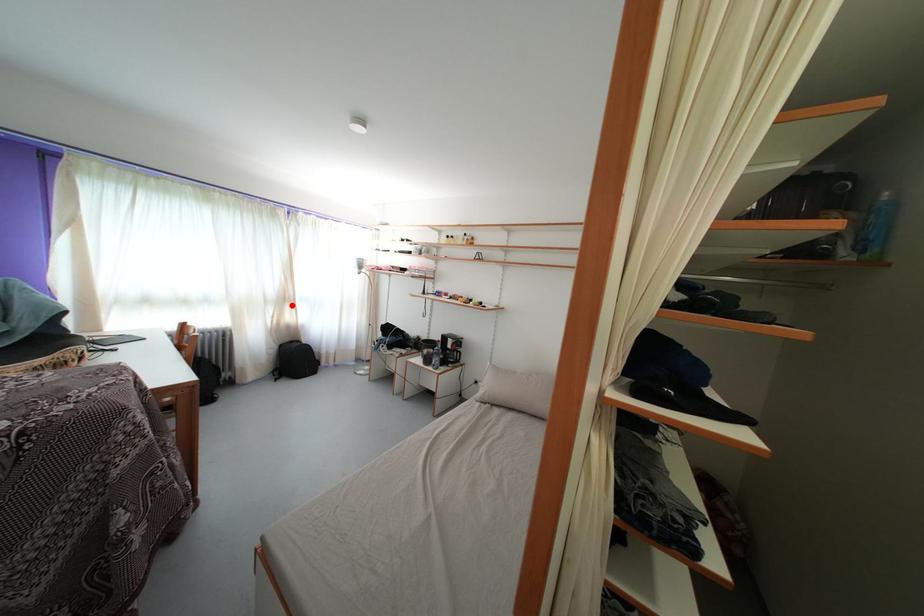
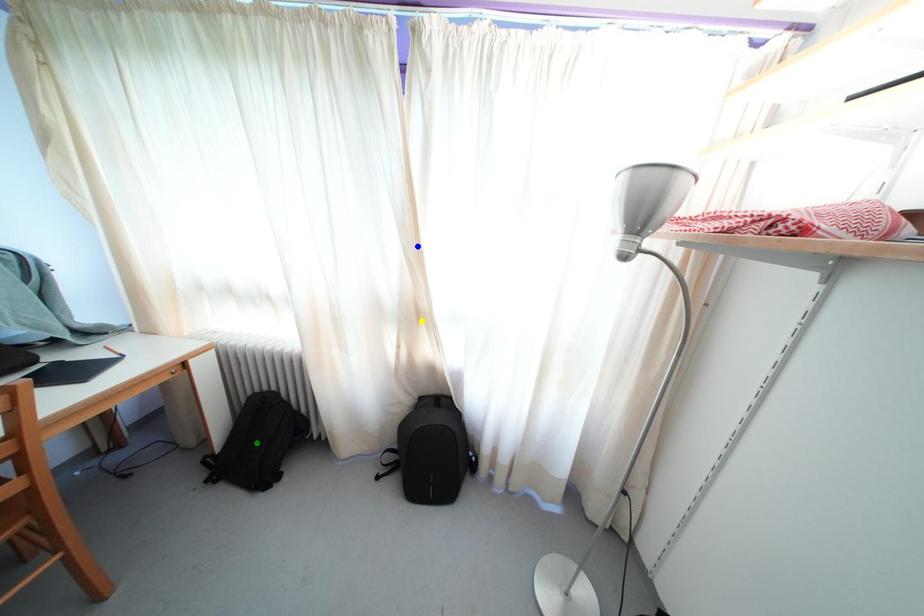
Question: I am providing you with two images of the same scene from different viewpoints. A red point is marked on the first image. You are given multiple points on the second image. Which mark in image 2 goes with the point in image 1?

Choices:
 (A) yellow point
 (B) blue point
 (C) green point

Answer: (A)